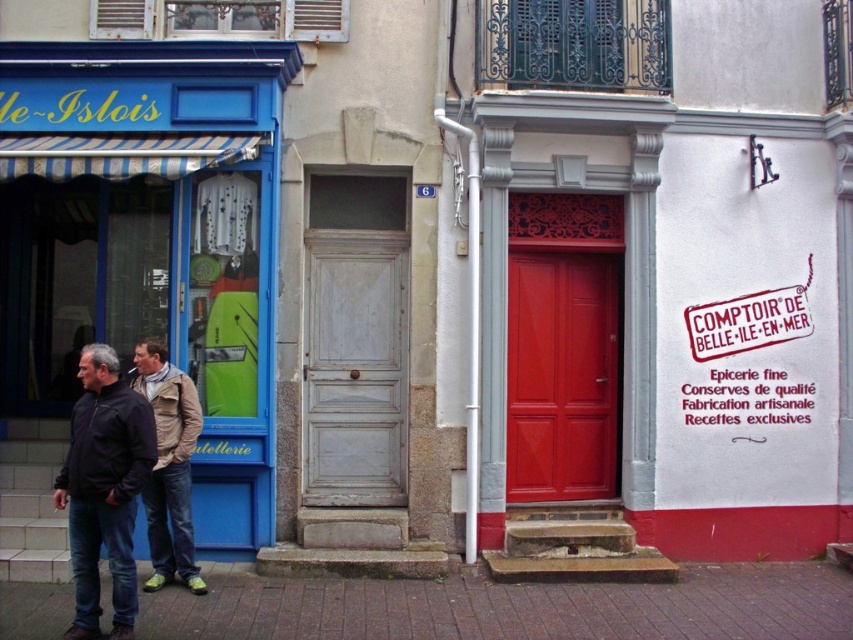
You are a delivery person trying to find the correct entrance to drop off a package. You see a white wooden door at center and a rubber stamp sign at center. Which one is located to the left of the other?

The white wooden door at center is positioned on the left side of the rubber stamp sign at center.

Consider the image. You are standing in the street and see the matte blue storefront at left. You want to take a photo of it with your camera. The camera requires you to be exactly 23 feet away to focus properly. Can you step closer or farther away to achieve the correct distance?

The matte blue storefront at left and camera are 23.28 feet apart. To achieve the required 23 feet distance, you need to move 0.28 feet closer to the matte blue storefront at left.